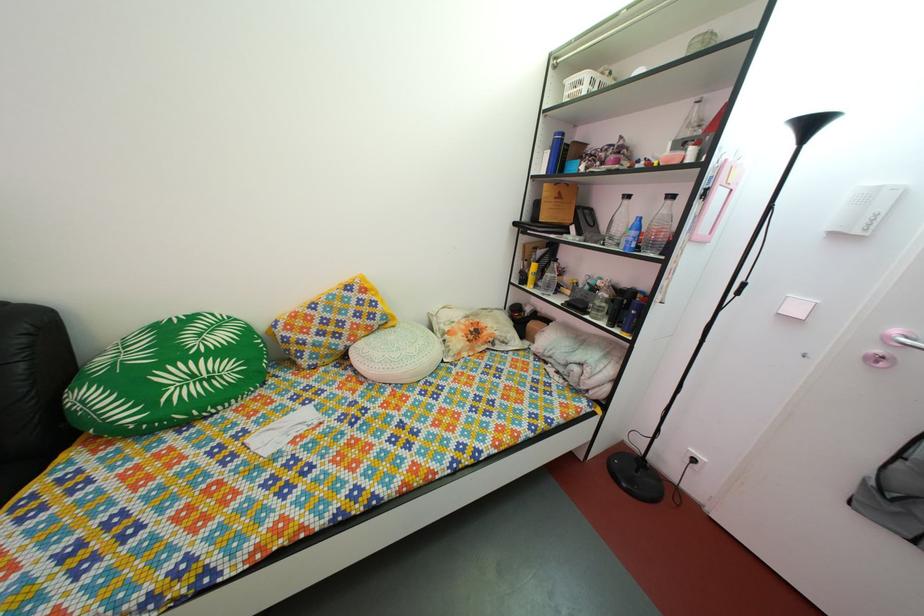
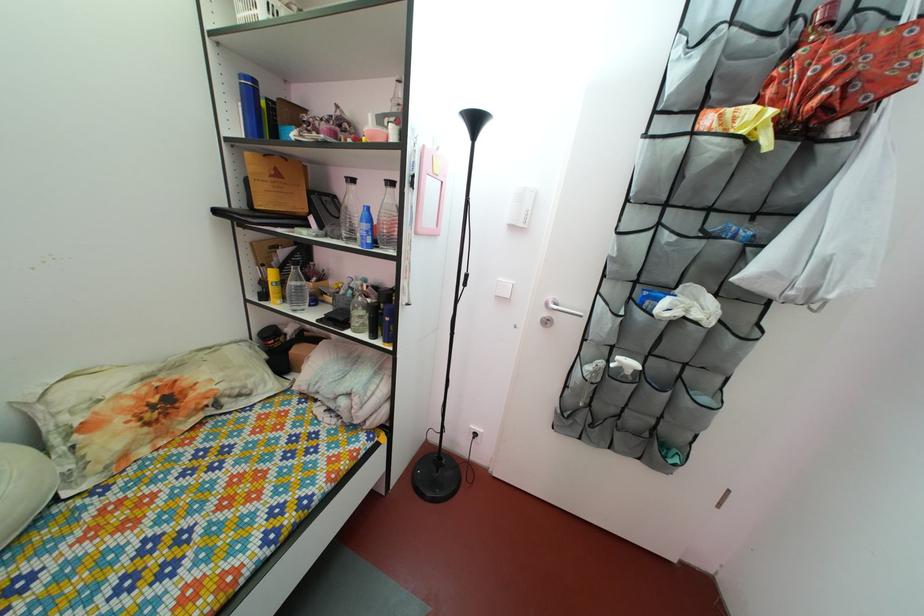
The point at (596,296) is marked in the first image. Where is the corresponding point in the second image?

(359, 301)